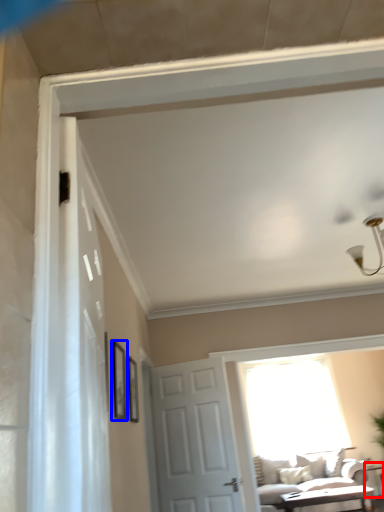
Question: Which object is closer to the camera taking this photo, table (highlighted by a red box) or picture frame (highlighted by a blue box)?

Choices:
 (A) table
 (B) picture frame

Answer: (B)